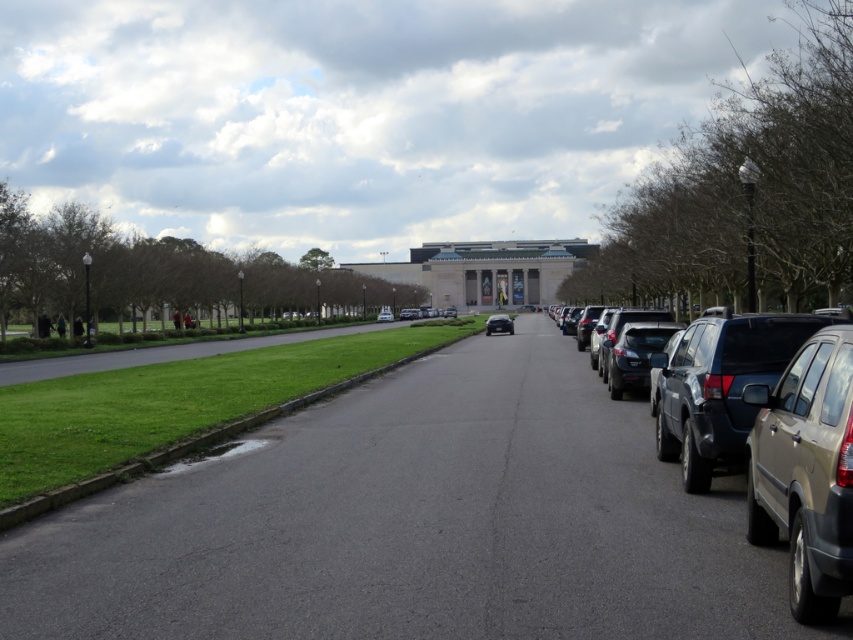
Between matte black suv at right and white glossy sedan at center, which one appears on the left side from the viewer's perspective?

white glossy sedan at center is more to the left.

Does matte black suv at right have a greater width compared to white glossy sedan at center?

Incorrect, matte black suv at right's width does not surpass white glossy sedan at center's.

This screenshot has height=640, width=853. Identify the location of matte black suv at right. (753, 428).

In the scene shown: Is matte black suv at right to the left of gold matte suv at right from the viewer's perspective?

In fact, matte black suv at right is to the right of gold matte suv at right.

Who is positioned more to the right, matte black suv at right or gold matte suv at right?

matte black suv at right

In the scene shown: Who is more distant from viewer, (740,435) or (784,493)?

The point (740,435) is more distant.

What are the coordinates of `matte black suv at right` in the screenshot? It's located at (753, 428).

Does matte black suv at right appear over satin black car at center?

Correct, matte black suv at right is located above satin black car at center.

Does matte black suv at right have a smaller size compared to satin black car at center?

Indeed, matte black suv at right has a smaller size compared to satin black car at center.

Is point (757, 324) positioned behind point (502, 326)?

No, it is in front of (502, 326).

The width and height of the screenshot is (853, 640). Find the location of `matte black suv at right`. matte black suv at right is located at coordinates pos(753,428).